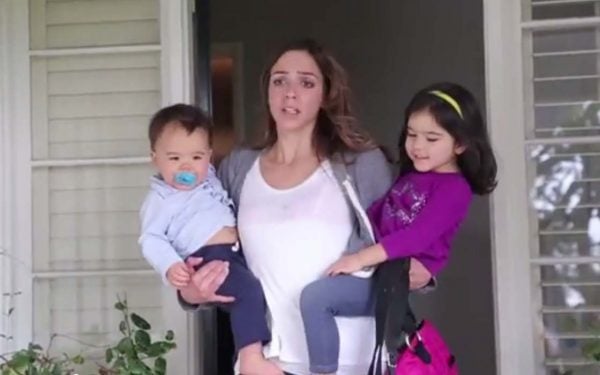
Locate an element on the screen. This screenshot has width=600, height=375. ring hook is located at coordinates (411, 340).